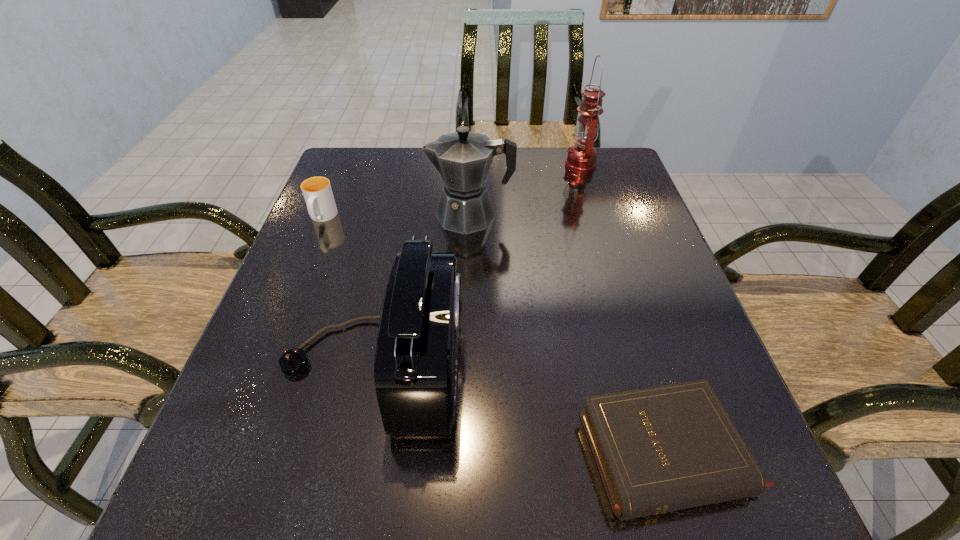
Locate an element on the screen. the tallest object is located at coordinates (581, 158).

Where is `oil lamp`? oil lamp is located at coordinates (581, 158).

Identify the location of coffeepot. (463, 158).

I want to click on radio receiver, so click(x=415, y=368).

Identify the location of the second shortest object. The height and width of the screenshot is (540, 960). (317, 192).

This screenshot has width=960, height=540. In order to click on cup in this screenshot , I will do `click(317, 192)`.

Locate an element on the screen. The image size is (960, 540). Bible is located at coordinates (660, 449).

This screenshot has height=540, width=960. I want to click on vacant space located on the front of the tallest object, so (x=594, y=210).

I want to click on vacant space situated at the spout of the coffeepot, so click(x=320, y=215).

At what (x,y) coordinates should I click in order to perform the action: click on vacant area located 0.210m at the spout of the coffeepot. Please return your answer as a coordinate pair (x, y). The image size is (960, 540). Looking at the image, I should click on (344, 215).